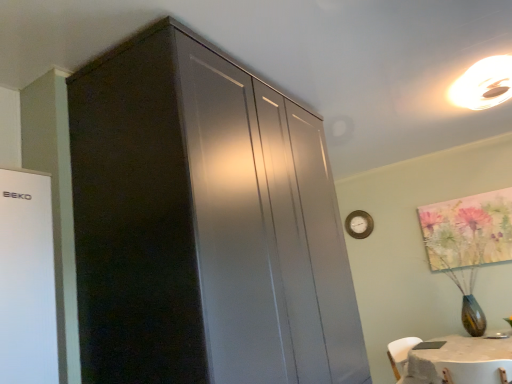
Locate an element on the screen. Image resolution: width=512 pixels, height=384 pixels. wooden clock at upper right is located at coordinates (359, 224).

What do you see at coordinates (468, 230) in the screenshot?
I see `watercolor floral painting at upper right` at bounding box center [468, 230].

Identify the location of wooden clock at upper right. (359, 224).

Considering the relative positions of matte black cabinet at upper left and watercolor floral painting at upper right in the image provided, is matte black cabinet at upper left to the right of watercolor floral painting at upper right from the viewer's perspective?

In fact, matte black cabinet at upper left is to the left of watercolor floral painting at upper right.

Can you confirm if matte black cabinet at upper left is taller than watercolor floral painting at upper right?

Indeed, matte black cabinet at upper left has a greater height compared to watercolor floral painting at upper right.

In terms of width, does matte black cabinet at upper left look wider or thinner when compared to watercolor floral painting at upper right?

In the image, matte black cabinet at upper left appears to be wider than watercolor floral painting at upper right.

From a real-world perspective, is matte white ceiling light at upper right over watercolor floral painting at upper right?

Yes, from a real-world perspective, matte white ceiling light at upper right is above watercolor floral painting at upper right.

Measure the distance between matte white ceiling light at upper right and watercolor floral painting at upper right.

matte white ceiling light at upper right and watercolor floral painting at upper right are 4.51 feet apart.

From the picture: How many degrees apart are the facing directions of matte white ceiling light at upper right and watercolor floral painting at upper right?

The angle between the facing direction of matte white ceiling light at upper right and the facing direction of watercolor floral painting at upper right is 1.44 degrees.

Is point (482, 107) more distant than point (468, 223)?

No, it is not.

From the picture: Is wooden clock at upper right not near matte white ceiling light at upper right?

That's right, there is a large distance between wooden clock at upper right and matte white ceiling light at upper right.

Can you confirm if wooden clock at upper right is thinner than matte white ceiling light at upper right?

Correct, the width of wooden clock at upper right is less than that of matte white ceiling light at upper right.

Looking at this image, is wooden clock at upper right further to camera compared to matte white ceiling light at upper right?

Yes, wooden clock at upper right is further from the viewer.

From a real-world perspective, is wooden clock at upper right physically below matte white ceiling light at upper right?

Indeed, from a real-world perspective, wooden clock at upper right is positioned beneath matte white ceiling light at upper right.

Is watercolor floral painting at upper right in front of or behind wooden clock at upper right in the image?

Clearly, watercolor floral painting at upper right is in front of wooden clock at upper right.

Does watercolor floral painting at upper right appear on the right side of wooden clock at upper right?

Yes.

Choose the correct answer: Is watercolor floral painting at upper right inside wooden clock at upper right or outside it?

watercolor floral painting at upper right is outside wooden clock at upper right.

Is matte black cabinet at upper left with matte white ceiling light at upper right?

No, matte black cabinet at upper left is not touching matte white ceiling light at upper right.

Based on the photo, between matte black cabinet at upper left and matte white ceiling light at upper right, which one appears on the left side from the viewer's perspective?

matte black cabinet at upper left.

Is matte black cabinet at upper left located outside matte white ceiling light at upper right?

matte black cabinet at upper left is positioned outside matte white ceiling light at upper right.

Which is more distant, (111, 86) or (490, 73)?

Positioned behind is point (490, 73).

Considering the sizes of objects watercolor floral painting at upper right and matte white ceiling light at upper right in the image provided, who is shorter, watercolor floral painting at upper right or matte white ceiling light at upper right?

Standing shorter between the two is matte white ceiling light at upper right.

Is watercolor floral painting at upper right inside the boundaries of matte white ceiling light at upper right, or outside?

watercolor floral painting at upper right is outside matte white ceiling light at upper right.

Is watercolor floral painting at upper right placed right next to matte white ceiling light at upper right?

No, watercolor floral painting at upper right is not making contact with matte white ceiling light at upper right.

Considering the sizes of watercolor floral painting at upper right and matte white ceiling light at upper right in the image, is watercolor floral painting at upper right wider or thinner than matte white ceiling light at upper right?

Considering their sizes, watercolor floral painting at upper right looks slimmer than matte white ceiling light at upper right.

From a real-world perspective, is matte white ceiling light at upper right on top of wooden clock at upper right?

Indeed, from a real-world perspective, matte white ceiling light at upper right stands above wooden clock at upper right.

Is matte white ceiling light at upper right touching wooden clock at upper right?

No, matte white ceiling light at upper right is not in contact with wooden clock at upper right.

Is matte white ceiling light at upper right situated inside wooden clock at upper right or outside?

matte white ceiling light at upper right is outside wooden clock at upper right.

Which of these two, matte white ceiling light at upper right or wooden clock at upper right, stands taller?

wooden clock at upper right.

This screenshot has height=384, width=512. I want to click on flower below the matte black cabinet at upper left (from the image's perspective), so click(x=468, y=230).

There is a watercolor floral painting at upper right. Where is `light fixture above it (from a real-world perspective)`? light fixture above it (from a real-world perspective) is located at coordinates (484, 84).

When comparing their distances from matte white ceiling light at upper right, does matte black cabinet at upper left or wooden clock at upper right seem further?

Based on the image, wooden clock at upper right appears to be further to matte white ceiling light at upper right.

Estimate the real-world distances between objects in this image. Which object is further from wooden clock at upper right, matte white ceiling light at upper right or matte black cabinet at upper left?

matte black cabinet at upper left is positioned further to the anchor wooden clock at upper right.

Considering their positions, is matte black cabinet at upper left positioned closer to wooden clock at upper right than matte white ceiling light at upper right?

matte white ceiling light at upper right is positioned closer to the anchor wooden clock at upper right.

Estimate the real-world distances between objects in this image. Which object is closer to matte black cabinet at upper left, wooden clock at upper right or watercolor floral painting at upper right?

The object closer to matte black cabinet at upper left is watercolor floral painting at upper right.

When comparing their distances from matte black cabinet at upper left, does wooden clock at upper right or matte white ceiling light at upper right seem closer?

matte white ceiling light at upper right is positioned closer to the anchor matte black cabinet at upper left.

Considering their positions, is matte black cabinet at upper left positioned further to watercolor floral painting at upper right than matte white ceiling light at upper right?

matte black cabinet at upper left.

When comparing their distances from matte white ceiling light at upper right, does wooden clock at upper right or watercolor floral painting at upper right seem closer?

Based on the image, watercolor floral painting at upper right appears to be nearer to matte white ceiling light at upper right.

Based on their spatial positions, is matte black cabinet at upper left or watercolor floral painting at upper right closer to matte white ceiling light at upper right?

watercolor floral painting at upper right is closer to matte white ceiling light at upper right.

At what (x,y) coordinates should I click in order to perform the action: click on flower located between matte black cabinet at upper left and wooden clock at upper right in the depth direction. Please return your answer as a coordinate pair (x, y). Looking at the image, I should click on (468, 230).

Image resolution: width=512 pixels, height=384 pixels. I want to click on light fixture between matte black cabinet at upper left and watercolor floral painting at upper right from front to back, so click(484, 84).

The image size is (512, 384). Identify the location of light fixture located between matte black cabinet at upper left and wooden clock at upper right in the depth direction. (484, 84).

The height and width of the screenshot is (384, 512). Find the location of `flower between matte white ceiling light at upper right and wooden clock at upper right in the front-back direction`. flower between matte white ceiling light at upper right and wooden clock at upper right in the front-back direction is located at coordinates (468, 230).